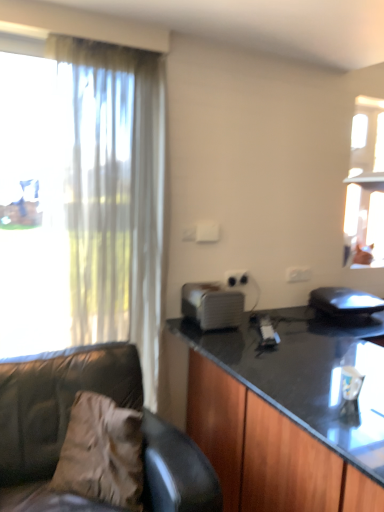
Question: Is white plastic toaster at center, positioned as the first appliance in left-to-right order, next to leather couch at left?

Choices:
 (A) yes
 (B) no

Answer: (B)

Question: Does white plastic toaster at center, which appears as the second appliance when viewed from the right, have a lesser width compared to leather couch at left?

Choices:
 (A) no
 (B) yes

Answer: (B)

Question: Is white plastic toaster at center, which appears as the second appliance when viewed from the right, oriented towards leather couch at left?

Choices:
 (A) no
 (B) yes

Answer: (A)

Question: From a real-world perspective, is white plastic toaster at center, positioned as the first appliance in left-to-right order, located higher than leather couch at left?

Choices:
 (A) yes
 (B) no

Answer: (A)

Question: Is leather couch at left at the back of white plastic toaster at center, which appears as the second appliance when viewed from the right?

Choices:
 (A) no
 (B) yes

Answer: (A)

Question: Is white plastic toaster at center, positioned as the first appliance in left-to-right order, to the right of leather couch at left from the viewer's perspective?

Choices:
 (A) no
 (B) yes

Answer: (B)

Question: Does translucent fabric curtain at left have a greater height compared to white plastic toaster at center, positioned as the first appliance in left-to-right order?

Choices:
 (A) no
 (B) yes

Answer: (B)

Question: Is translucent fabric curtain at left facing towards white plastic toaster at center, positioned as the first appliance in left-to-right order?

Choices:
 (A) no
 (B) yes

Answer: (A)

Question: Would you say translucent fabric curtain at left is outside white plastic toaster at center, which appears as the second appliance when viewed from the right?

Choices:
 (A) no
 (B) yes

Answer: (B)

Question: Can you confirm if translucent fabric curtain at left is shorter than white plastic toaster at center, positioned as the first appliance in left-to-right order?

Choices:
 (A) no
 (B) yes

Answer: (A)

Question: From a real-world perspective, is translucent fabric curtain at left on top of white plastic toaster at center, which appears as the second appliance when viewed from the right?

Choices:
 (A) yes
 (B) no

Answer: (A)

Question: From a real-world perspective, is translucent fabric curtain at left beneath white plastic toaster at center, positioned as the first appliance in left-to-right order?

Choices:
 (A) yes
 (B) no

Answer: (B)

Question: Does black glossy cabinet at right have a larger size compared to white plastic power outlet at center?

Choices:
 (A) yes
 (B) no

Answer: (A)